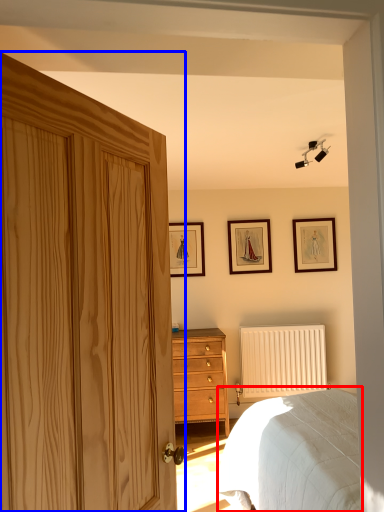
Question: Which object is further to the camera taking this photo, bed (highlighted by a red box) or door (highlighted by a blue box)?

Choices:
 (A) bed
 (B) door

Answer: (A)